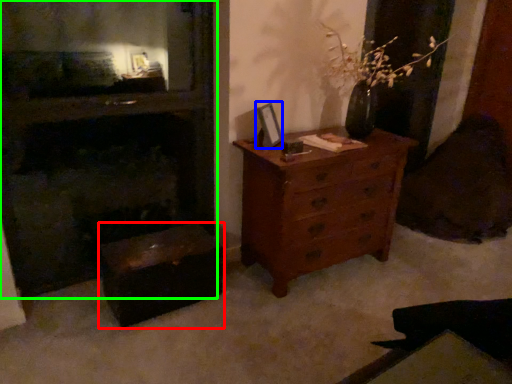
Question: Which object is positioned closest to vanity (highlighted by a red box)? Select from picture frame (highlighted by a blue box) and fireplace (highlighted by a green box).

Choices:
 (A) picture frame
 (B) fireplace

Answer: (B)